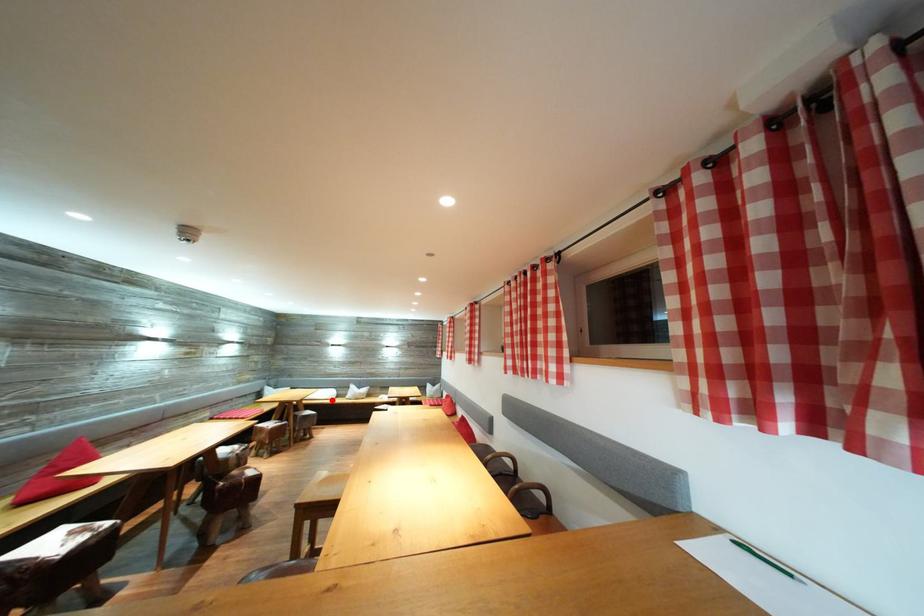
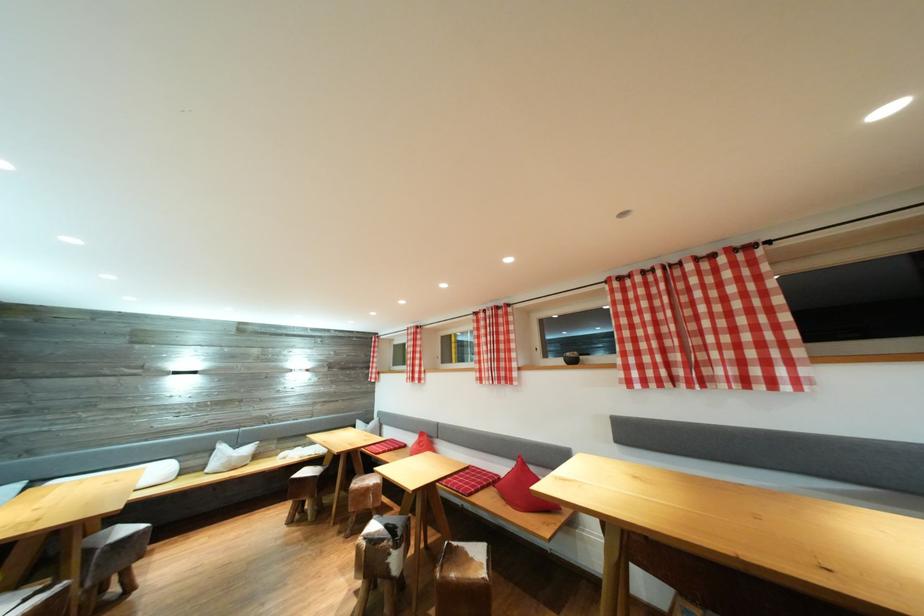
Find the pixel in the second image that matches the highlighted location in the first image.

(161, 483)